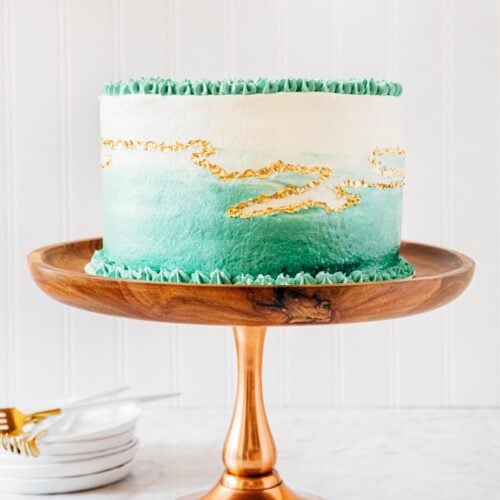
Where is `fork`? The width and height of the screenshot is (500, 500). fork is located at coordinates (19, 421), (9, 442).